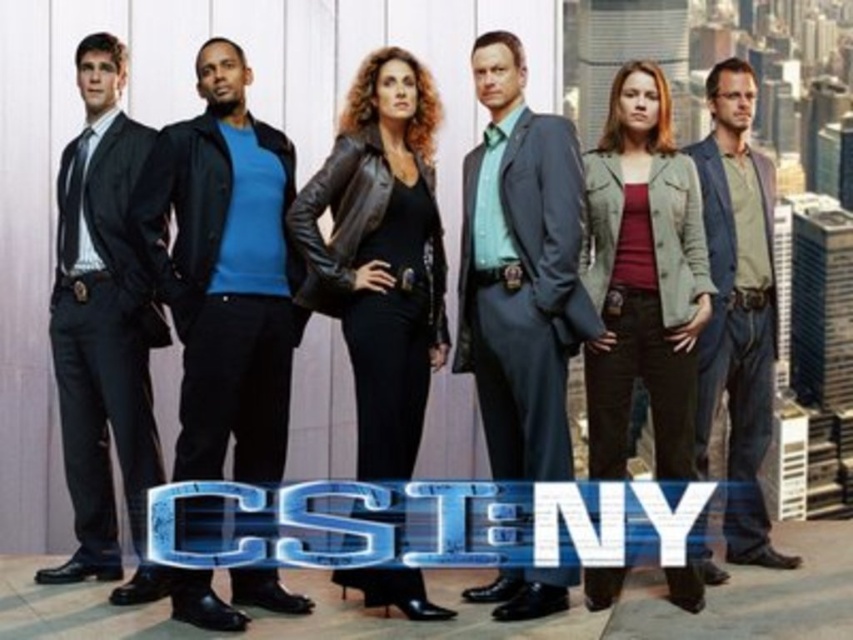
Question: In this image, where is black leather jacket at center located relative to denim jacket at right?

Choices:
 (A) above
 (B) below

Answer: (B)

Question: Based on their relative distances, which object is nearer to the matte gray suit at center?

Choices:
 (A) green textured jacket at center
 (B) denim jacket at right

Answer: (A)

Question: Which point is farther to the camera?

Choices:
 (A) (131, 355)
 (B) (430, 221)
 (C) (282, 176)
 (D) (596, 268)

Answer: (B)

Question: Considering the relative positions of green textured jacket at center and denim jacket at right in the image provided, where is green textured jacket at center located with respect to denim jacket at right?

Choices:
 (A) right
 (B) left

Answer: (B)

Question: Which of the following is the closest to the observer?

Choices:
 (A) denim jacket at right
 (B) blue leather jacket at center
 (C) green textured jacket at center

Answer: (B)

Question: Is black leather jacket at center positioned behind denim jacket at right?

Choices:
 (A) no
 (B) yes

Answer: (B)